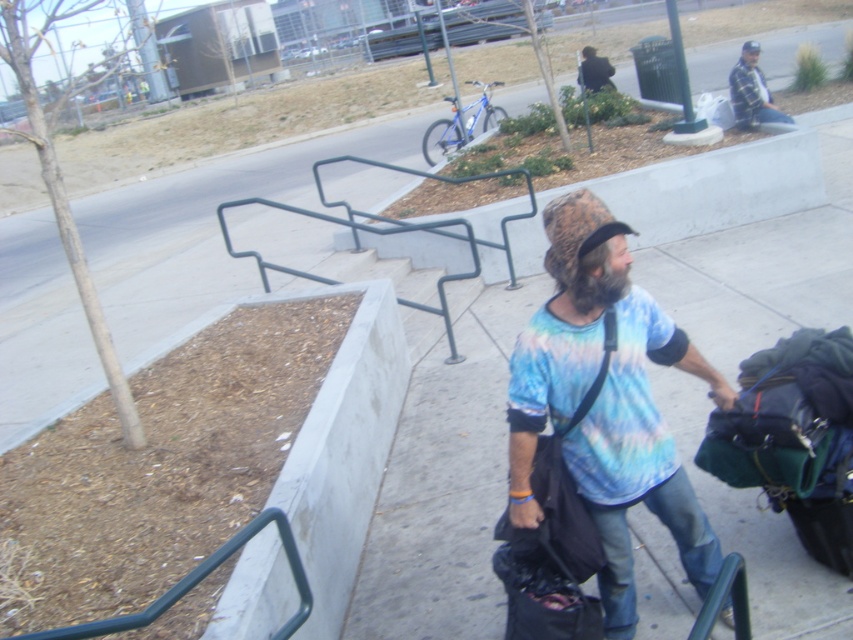
You are a delivery person trying to navigate through the urban area shown. You need to place a heavy box on the concrete sidewalk at center. However, there is a green matte rail at lower left nearby. Which object should you place the box on to ensure it stays on the higher ground?

The concrete sidewalk at center is located above the green matte rail at lower left, so placing the box on the concrete sidewalk at center will keep it on higher ground.